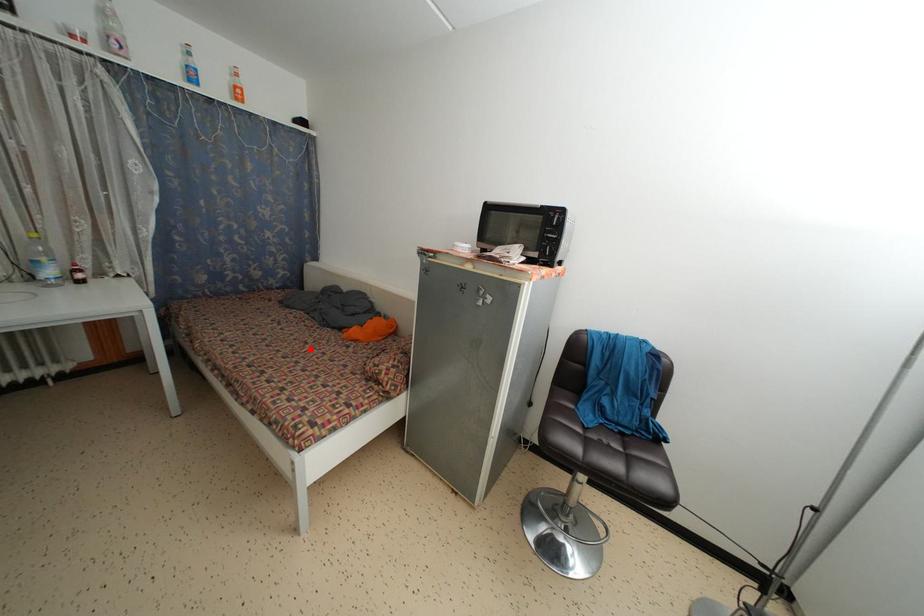
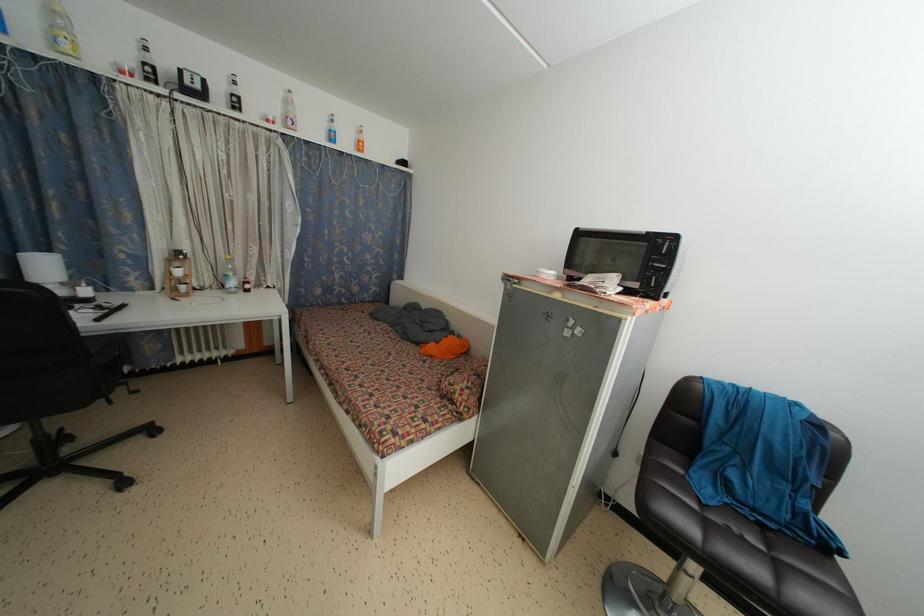
Locate, in the second image, the point that corresponds to the highlighted location in the first image.

(394, 360)